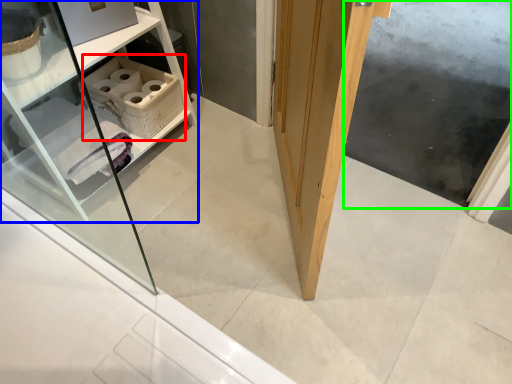
Question: Which object is the closest to the cabinetry (highlighted by a red box)? Choose among these: shelf (highlighted by a blue box) or screen door (highlighted by a green box).

Choices:
 (A) shelf
 (B) screen door

Answer: (A)